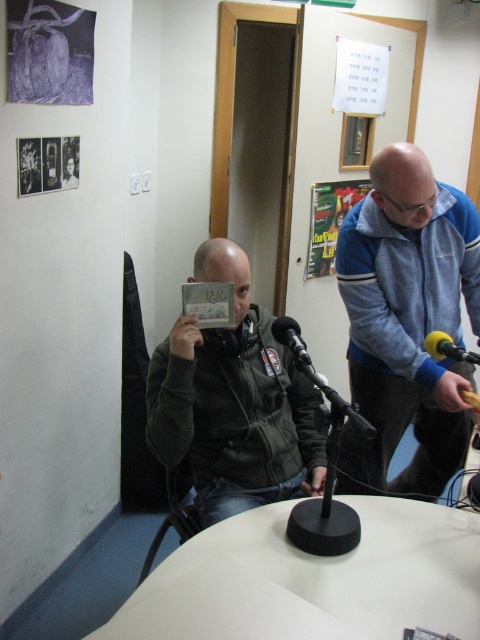
Question: Is white matte table at center thinner than black matte microphone at center?

Choices:
 (A) yes
 (B) no

Answer: (B)

Question: Does blue fleece jacket at upper right come behind yellow foam microphone at right?

Choices:
 (A) yes
 (B) no

Answer: (A)

Question: Which object is closer to the camera taking this photo?

Choices:
 (A) yellow foam microphone at right
 (B) dark gray jacket at center

Answer: (A)

Question: Which of the following is the farthest from the observer?

Choices:
 (A) black matte microphone at center
 (B) yellow foam microphone at right
 (C) blue fleece jacket at upper right
 (D) white matte table at center

Answer: (C)

Question: Which of the following is the closest to the observer?

Choices:
 (A) (372, 218)
 (B) (192, 576)
 (C) (465, 352)

Answer: (B)

Question: Does white matte table at center appear under yellow foam microphone at right?

Choices:
 (A) yes
 (B) no

Answer: (A)